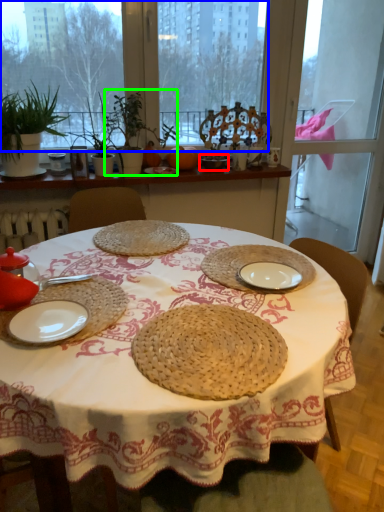
Question: Which object is the farthest from tableware (highlighted by a red box)? Choose among these: window screen (highlighted by a blue box) or plant (highlighted by a green box).

Choices:
 (A) window screen
 (B) plant

Answer: (A)